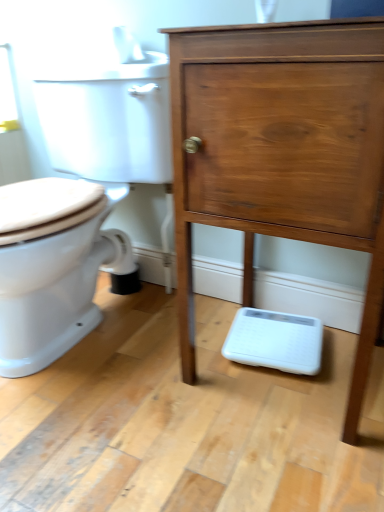
Describe the element at coordinates (78, 206) in the screenshot. I see `white glossy toilet at left` at that location.

In the scene shown: What is the approximate width of white glossy toilet at left?

69.98 centimeters.

Locate an element on the screen. Image resolution: width=384 pixels, height=512 pixels. white glossy toilet at left is located at coordinates pos(78,206).

Describe the element at coordinates (282, 152) in the screenshot. I see `matte wood chest of drawers at center` at that location.

Find the location of `matte wood chest of drawers at center`. matte wood chest of drawers at center is located at coordinates (282, 152).

Identify the location of white glossy toilet at left. (78, 206).

Considering the relative positions of matte wood chest of drawers at center and white glossy toilet at left in the image provided, is matte wood chest of drawers at center to the left or to the right of white glossy toilet at left?

Clearly, matte wood chest of drawers at center is on the right of white glossy toilet at left in the image.

Relative to white glossy toilet at left, is matte wood chest of drawers at center in front or behind?

In the image, matte wood chest of drawers at center appears in front of white glossy toilet at left.

Does point (203, 83) come behind point (56, 268)?

No, it is not.

From the image's perspective, which one is positioned higher, matte wood chest of drawers at center or white glossy toilet at left?

From the image's view, white glossy toilet at left is above.

From a real-world perspective, between matte wood chest of drawers at center and white glossy toilet at left, who is vertically higher?

In real-world perspective, matte wood chest of drawers at center is above.

Does matte wood chest of drawers at center have a greater width compared to white glossy toilet at left?

No, matte wood chest of drawers at center is not wider than white glossy toilet at left.

Who is taller, matte wood chest of drawers at center or white glossy toilet at left?

matte wood chest of drawers at center.

Considering the sizes of matte wood chest of drawers at center and white glossy toilet at left in the image, is matte wood chest of drawers at center bigger or smaller than white glossy toilet at left?

matte wood chest of drawers at center is smaller than white glossy toilet at left.

Is matte wood chest of drawers at center completely or partially outside of white glossy toilet at left?

Yes, matte wood chest of drawers at center is not within white glossy toilet at left.

Are matte wood chest of drawers at center and white glossy toilet at left far apart?

No, matte wood chest of drawers at center is not far from white glossy toilet at left.

Could you tell me if matte wood chest of drawers at center is facing white glossy toilet at left?

No.

How distant is matte wood chest of drawers at center from white glossy toilet at left?

matte wood chest of drawers at center and white glossy toilet at left are 19.23 inches apart from each other.

At what (x,y) coordinates should I click in order to perform the action: click on toilet located underneath the matte wood chest of drawers at center (from a real-world perspective). Please return your answer as a coordinate pair (x, y). Looking at the image, I should click on (78, 206).

Based on their positions, is white glossy toilet at left located to the left or right of matte wood chest of drawers at center?

Clearly, white glossy toilet at left is on the left of matte wood chest of drawers at center in the image.

Which object is further away from the camera, white glossy toilet at left or matte wood chest of drawers at center?

white glossy toilet at left.

Does point (27, 223) appear closer or farther from the camera than point (190, 69)?

Clearly, point (27, 223) is more distant from the camera than point (190, 69).

In the scene shown: From the image's perspective, relative to matte wood chest of drawers at center, is white glossy toilet at left above or below?

white glossy toilet at left is above matte wood chest of drawers at center.

From a real-world perspective, is white glossy toilet at left above or below matte wood chest of drawers at center?

Clearly, from a real-world perspective, white glossy toilet at left is below matte wood chest of drawers at center.

Looking at their sizes, would you say white glossy toilet at left is wider or thinner than matte wood chest of drawers at center?

In the image, white glossy toilet at left appears to be wider than matte wood chest of drawers at center.

Who is taller, white glossy toilet at left or matte wood chest of drawers at center?

Standing taller between the two is matte wood chest of drawers at center.

Who is smaller, white glossy toilet at left or matte wood chest of drawers at center?

Smaller between the two is matte wood chest of drawers at center.

Is matte wood chest of drawers at center a part of white glossy toilet at left?

No, matte wood chest of drawers at center is located outside of white glossy toilet at left.

Based on the photo, are white glossy toilet at left and matte wood chest of drawers at center far apart?

No, white glossy toilet at left is not far away from matte wood chest of drawers at center.

Could you tell me if white glossy toilet at left is facing matte wood chest of drawers at center?

No, white glossy toilet at left is not turned towards matte wood chest of drawers at center.

Measure the distance from white glossy toilet at left to matte wood chest of drawers at center.

white glossy toilet at left and matte wood chest of drawers at center are 19.23 inches apart.

The image size is (384, 512). In order to click on toilet below the matte wood chest of drawers at center (from a real-world perspective) in this screenshot , I will do 78,206.

You are a GUI agent. You are given a task and a screenshot of the screen. Output one action in this format:
    pyautogui.click(x=<x>, y=<y>)
    Task: Click on the chest of drawers in front of the white glossy toilet at left
    Image resolution: width=384 pixels, height=512 pixels.
    Given the screenshot: What is the action you would take?
    pyautogui.click(x=282, y=152)

Identify the location of chest of drawers on the right of white glossy toilet at left. The height and width of the screenshot is (512, 384). (282, 152).